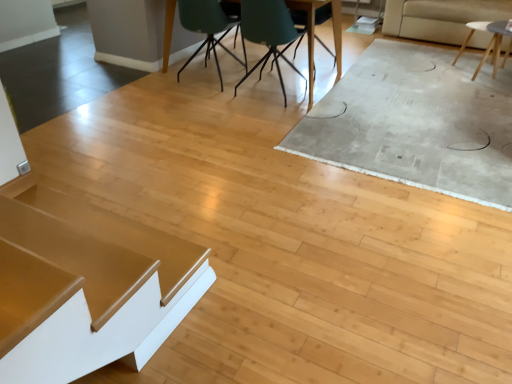
Question: Can you confirm if shiny gold table at lower left, the first table positioned from the left, is bigger than teal matte chair at center, acting as the 2th chair starting from the left?

Choices:
 (A) yes
 (B) no

Answer: (B)

Question: Does shiny gold table at lower left, which is counted as the 3th table, starting from the top, have a smaller size compared to teal matte chair at center, acting as the 2th chair starting from the left?

Choices:
 (A) no
 (B) yes

Answer: (B)

Question: Is shiny gold table at lower left, which is counted as the 3th table, starting from the top, directly adjacent to teal matte chair at center, acting as the 2th chair starting from the left?

Choices:
 (A) yes
 (B) no

Answer: (B)

Question: From a real-world perspective, is shiny gold table at lower left, the first table positioned from the left, located higher than teal matte chair at center, acting as the 2th chair starting from the left?

Choices:
 (A) yes
 (B) no

Answer: (B)

Question: From a real-world perspective, is shiny gold table at lower left, which is the first table from bottom to top, below teal matte chair at center, acting as the 2th chair starting from the left?

Choices:
 (A) yes
 (B) no

Answer: (A)

Question: From a real-world perspective, is white matte table at upper right, the third table in the front-to-back sequence, positioned above or below teal matte chair at center, the 2th chair in the right-to-left sequence?

Choices:
 (A) above
 (B) below

Answer: (B)

Question: In terms of size, does white matte table at upper right, which ranks as the first table in back-to-front order, appear bigger or smaller than teal matte chair at center, acting as the 2th chair starting from the left?

Choices:
 (A) small
 (B) big

Answer: (A)

Question: In the image, is white matte table at upper right, which is the 3th table from left to right, positioned in front of or behind teal matte chair at center, acting as the 2th chair starting from the left?

Choices:
 (A) behind
 (B) front

Answer: (A)

Question: Considering the positions of white matte table at upper right, which ranks as the first table in back-to-front order, and teal matte chair at center, the 2th chair in the right-to-left sequence, in the image, is white matte table at upper right, which ranks as the first table in back-to-front order, wider or thinner than teal matte chair at center, the 2th chair in the right-to-left sequence,?

Choices:
 (A) thin
 (B) wide

Answer: (B)

Question: Is shiny gold table at lower left, which is counted as the 3th table, starting from the top, situated inside white matte table at upper right, which is the 2th table in bottom-to-top order, or outside?

Choices:
 (A) inside
 (B) outside

Answer: (B)

Question: Considering the positions of shiny gold table at lower left, the first table positioned from the left, and white matte table at upper right, which is the 2th table in bottom-to-top order, in the image, is shiny gold table at lower left, the first table positioned from the left, wider or thinner than white matte table at upper right, which is the 2th table in bottom-to-top order,?

Choices:
 (A) wide
 (B) thin

Answer: (B)

Question: From the image's perspective, relative to white matte table at upper right, which is the 2th table in bottom-to-top order, is shiny gold table at lower left, which is counted as the 3th table, starting from the top, above or below?

Choices:
 (A) below
 (B) above

Answer: (A)

Question: From their relative heights in the image, would you say shiny gold table at lower left, which is counted as the 3th table, starting from the top, is taller or shorter than white matte table at upper right, which is the 2th table in bottom-to-top order?

Choices:
 (A) tall
 (B) short

Answer: (B)

Question: Looking at their shapes, would you say teal fabric chair at center, the 1th chair in the right-to-left sequence, is wider or thinner than matte teal chair at upper center, placed as the 3th chair when sorted from right to left?

Choices:
 (A) wide
 (B) thin

Answer: (B)

Question: In the image, is teal fabric chair at center, the 1th chair in the right-to-left sequence, positioned in front of or behind matte teal chair at upper center, placed as the 3th chair when sorted from right to left?

Choices:
 (A) front
 (B) behind

Answer: (B)